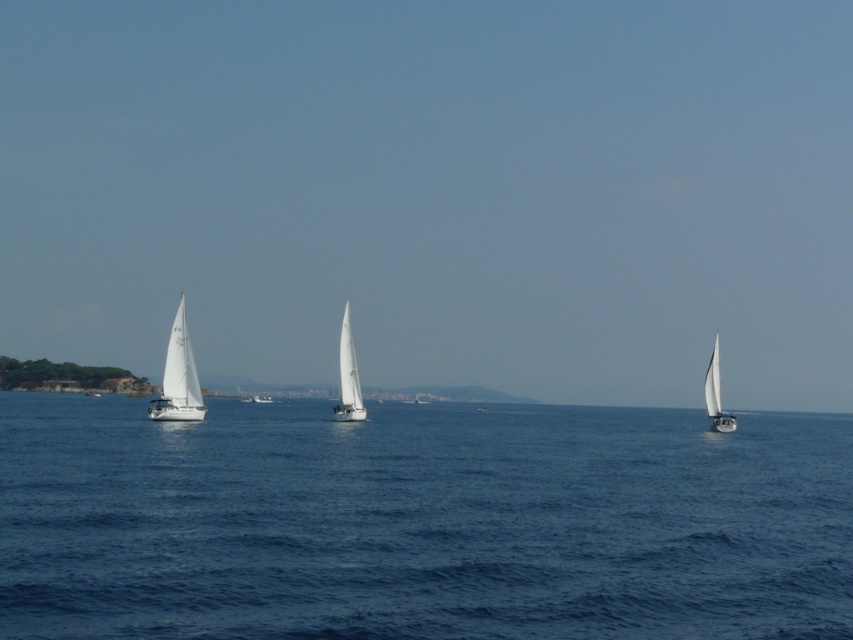
Is white matte sailboat at left closer to the viewer compared to white matte sailboat at right?

Yes, it is.

Does point (181, 301) come in front of point (718, 429)?

Yes, point (181, 301) is in front of point (718, 429).

Find the location of `white matte sailboat at left`. white matte sailboat at left is located at coordinates (178, 378).

Which is in front, point (142, 516) or point (717, 348)?

Point (142, 516)

Is blue water at center below white matte sailboat at right?

Yes, blue water at center is below white matte sailboat at right.

The width and height of the screenshot is (853, 640). Identify the location of blue water at center. (421, 522).

Which of these two, blue water at center or white matte sailboat at left, stands taller?

blue water at center

From the picture: Is blue water at center taller than white matte sailboat at left?

Yes, blue water at center is taller than white matte sailboat at left.

Where is `blue water at center`? blue water at center is located at coordinates (421, 522).

Image resolution: width=853 pixels, height=640 pixels. I want to click on blue water at center, so click(421, 522).